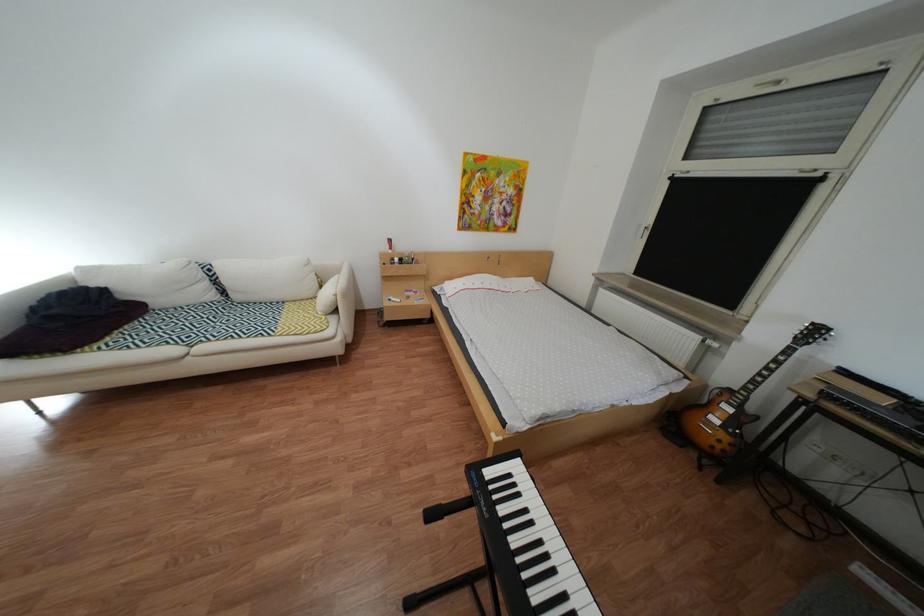
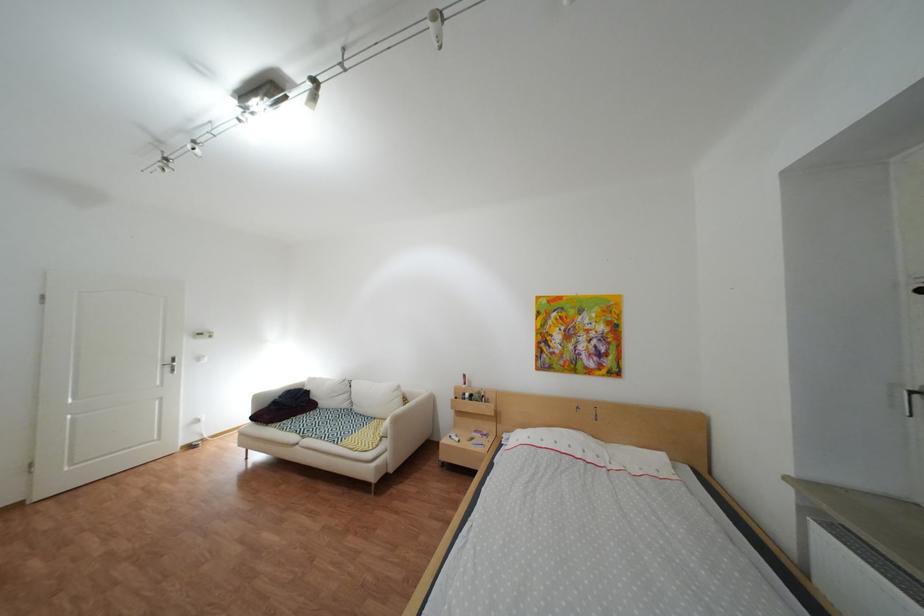
Locate, in the second image, the point that corresponds to pixel 408 300 in the first image.

(469, 438)